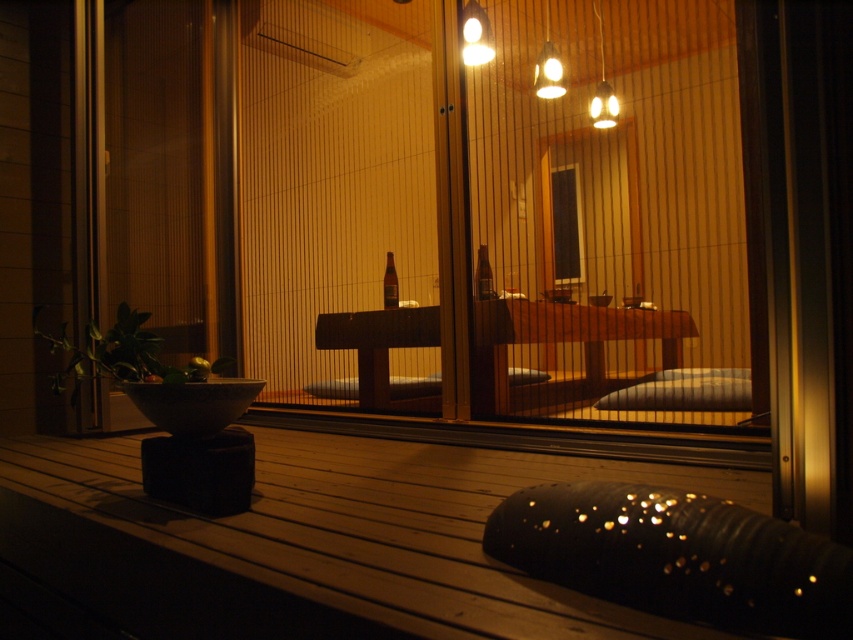
Looking at this image, who is positioned more to the left, matte glass bottle at center or brown glass bottle at center?

brown glass bottle at center

Does matte glass bottle at center have a greater height compared to brown glass bottle at center?

No, matte glass bottle at center is not taller than brown glass bottle at center.

The width and height of the screenshot is (853, 640). Find the location of `matte glass bottle at center`. matte glass bottle at center is located at coordinates (483, 275).